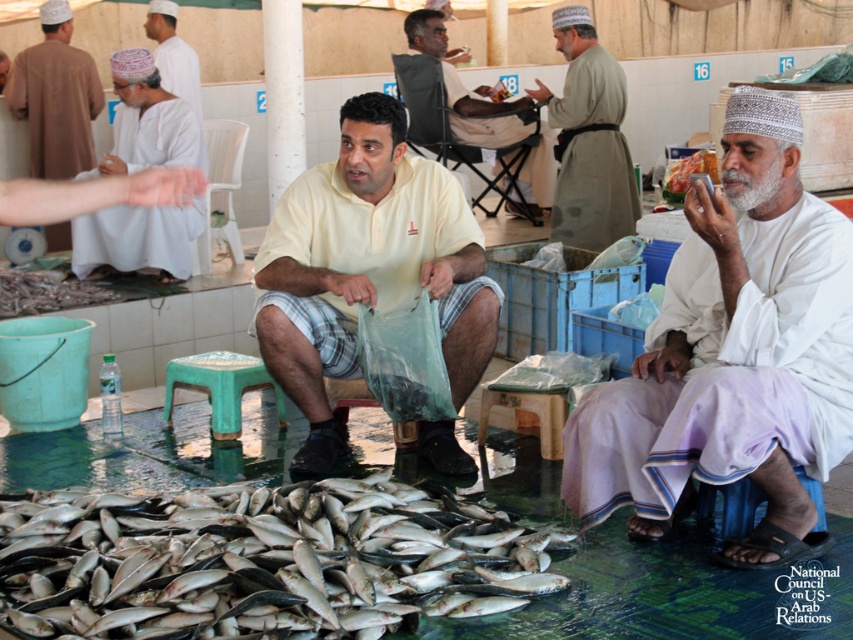
Question: Estimate the real-world distances between objects in this image. Which object is closer to the silver shiny fish at lower center?

Choices:
 (A) light beige fabric at center
 (B) matte white robe at upper left
 (C) white cotton shirt at center
 (D) green plastic stool at center

Answer: (D)

Question: From the image, what is the correct spatial relationship of yellow matte shirt at center in relation to light beige fabric at center?

Choices:
 (A) above
 (B) below

Answer: (B)

Question: Which object is farther from the camera taking this photo?

Choices:
 (A) silver shiny fish at lower center
 (B) green plastic stool at center
 (C) light beige fabric at center

Answer: (C)

Question: Which object is positioned closest to the light beige fabric at center?

Choices:
 (A) light beige shirt at center
 (B) yellow matte shirt at center
 (C) silver shiny fish at lower center
 (D) white cotton headscarf at upper left

Answer: (D)

Question: Is silver shiny fish at lower center further to the viewer compared to white cotton headscarf at upper left?

Choices:
 (A) no
 (B) yes

Answer: (A)

Question: Is yellow matte shirt at center below light beige fabric at center?

Choices:
 (A) no
 (B) yes

Answer: (B)